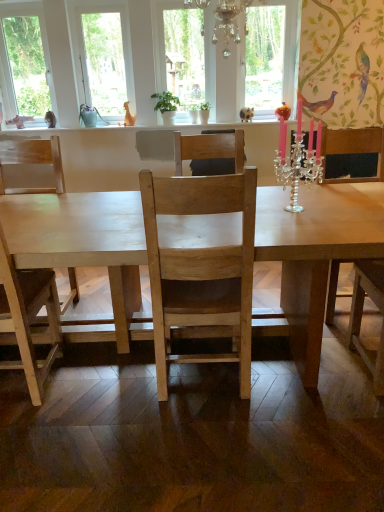
Question: Based on their sizes in the image, would you say natural wood chair at center, which is the second chair in left-to-right order, is bigger or smaller than silver/crystal candle holder at upper right?

Choices:
 (A) big
 (B) small

Answer: (A)

Question: Considering the positions of point (185, 159) and point (306, 161), is point (185, 159) closer or farther from the camera than point (306, 161)?

Choices:
 (A) farther
 (B) closer

Answer: (A)

Question: Estimate the real-world distances between objects in this image. Which object is closer to the natural wood chair at left, the first chair when ordered from left to right?

Choices:
 (A) clear glass window at upper left, the second window viewed from the right
 (B) silver/crystal candle holder at upper right
 (C) clear glass window at center, which ranks as the 2th window frame in left-to-right order
 (D) green matte plant at center
 (E) white wood frame at upper left, which is counted as the first window frame, starting from the left

Answer: (E)

Question: Estimate the real-world distances between objects in this image. Which object is closer to the silver/crystal candle holder at upper right?

Choices:
 (A) light wood table at center
 (B) natural wood chair at center, which is the second chair in left-to-right order
 (C) clear glass window at center, the 1th window frame viewed from the right
 (D) white wood frame at upper left, which is counted as the first window frame, starting from the left
 (E) wooden chair at right

Answer: (E)